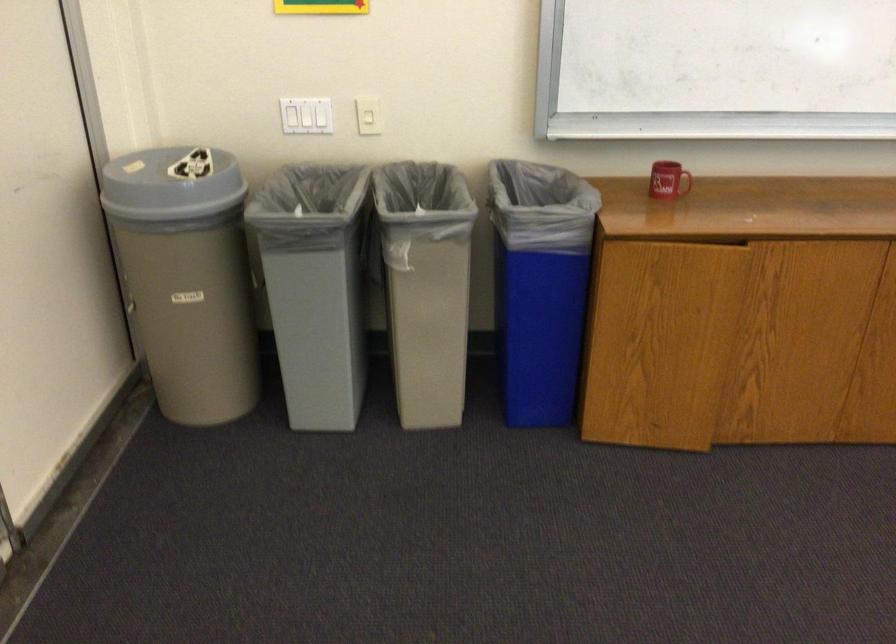
Find where to plac the beige trash can. Please return your answer as a coordinate pair (x, y).

(186, 277)